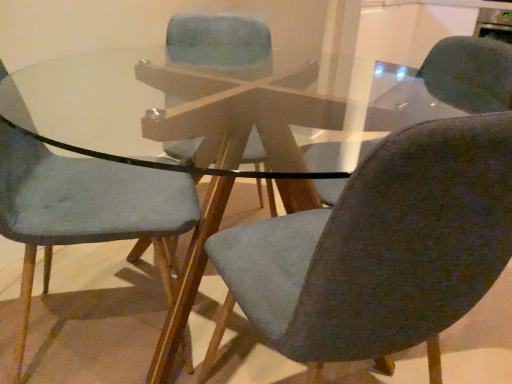
Describe the element at coordinates (220, 44) in the screenshot. The height and width of the screenshot is (384, 512). I see `textured fabric chair at center, marked as the 2th chair in a right-to-left arrangement` at that location.

At what (x,y) coordinates should I click in order to perform the action: click on textured gray chair at center, marked as the 1th chair in a right-to-left arrangement. Please return your answer as a coordinate pair (x, y). This screenshot has width=512, height=384. Looking at the image, I should click on (381, 247).

From a real-world perspective, is textured gray chair at center, marked as the 1th chair in a right-to-left arrangement, above or below textured fabric chair at center, placed as the second chair when sorted from left to right?

From a real-world perspective, textured gray chair at center, marked as the 1th chair in a right-to-left arrangement, is physically below textured fabric chair at center, placed as the second chair when sorted from left to right.

From the image's perspective, is textured gray chair at center, marked as the 1th chair in a right-to-left arrangement, positioned above or below textured fabric chair at center, marked as the 2th chair in a right-to-left arrangement?

From the image's perspective, textured gray chair at center, marked as the 1th chair in a right-to-left arrangement, appears below textured fabric chair at center, marked as the 2th chair in a right-to-left arrangement.

Is textured gray chair at center, the third chair in the left-to-right sequence, touching textured fabric chair at center, marked as the 2th chair in a right-to-left arrangement?

No, textured gray chair at center, the third chair in the left-to-right sequence, is not touching textured fabric chair at center, marked as the 2th chair in a right-to-left arrangement.

From the image's perspective, which object appears higher, matte gray chair at left, the 3th chair from the right, or textured fabric chair at center, placed as the second chair when sorted from left to right?

textured fabric chair at center, placed as the second chair when sorted from left to right, from the image's perspective.

Where is `chair that is behind the matte gray chair at left, the 3th chair from the right`? This screenshot has width=512, height=384. chair that is behind the matte gray chair at left, the 3th chair from the right is located at coordinates (220, 44).

Does matte gray chair at left, the 3th chair from the right, touch textured fabric chair at center, placed as the second chair when sorted from left to right?

There is a gap between matte gray chair at left, the 3th chair from the right, and textured fabric chair at center, placed as the second chair when sorted from left to right.

How different are the orientations of matte gray chair at left, the 1th chair positioned from the left, and textured fabric chair at center, marked as the 2th chair in a right-to-left arrangement, in degrees?

The angle between the facing direction of matte gray chair at left, the 1th chair positioned from the left, and the facing direction of textured fabric chair at center, marked as the 2th chair in a right-to-left arrangement, is 92.8 degrees.

Based on the photo, considering the sizes of objects textured gray chair at center, the third chair in the left-to-right sequence, and matte gray chair at left, the 3th chair from the right, in the image provided, who is bigger, textured gray chair at center, the third chair in the left-to-right sequence, or matte gray chair at left, the 3th chair from the right,?

Bigger between the two is textured gray chair at center, the third chair in the left-to-right sequence.

Is point (451, 246) closer to camera compared to point (168, 195)?

That is True.

In the image, is textured gray chair at center, marked as the 1th chair in a right-to-left arrangement, positioned in front of or behind matte gray chair at left, the 3th chair from the right?

textured gray chair at center, marked as the 1th chair in a right-to-left arrangement, is in front of matte gray chair at left, the 3th chair from the right.

What's the angular difference between matte gray chair at left, the 1th chair positioned from the left, and textured gray chair at center, marked as the 1th chair in a right-to-left arrangement,'s facing directions?

There is a 106-degree angle between the facing directions of matte gray chair at left, the 1th chair positioned from the left, and textured gray chair at center, marked as the 1th chair in a right-to-left arrangement.

Is matte gray chair at left, the 3th chair from the right, shorter than textured gray chair at center, marked as the 1th chair in a right-to-left arrangement?

No.

Which point is more forward, (189,204) or (426,298)?

The point (426,298) is in front.

From a real-world perspective, is matte gray chair at left, the 1th chair positioned from the left, on top of textured gray chair at center, marked as the 1th chair in a right-to-left arrangement?

Yes, from a real-world perspective, matte gray chair at left, the 1th chair positioned from the left, is over textured gray chair at center, marked as the 1th chair in a right-to-left arrangement

Can you confirm if textured fabric chair at center, placed as the second chair when sorted from left to right, is bigger than textured gray chair at center, the third chair in the left-to-right sequence?

No, textured fabric chair at center, placed as the second chair when sorted from left to right, is not bigger than textured gray chair at center, the third chair in the left-to-right sequence.

Is textured gray chair at center, the third chair in the left-to-right sequence, completely or partially inside textured fabric chair at center, placed as the second chair when sorted from left to right?

No, textured fabric chair at center, placed as the second chair when sorted from left to right, does not contain textured gray chair at center, the third chair in the left-to-right sequence.

Which is behind, point (238, 73) or point (411, 255)?

The point (238, 73) is behind.

How many degrees apart are the facing directions of textured fabric chair at center, marked as the 2th chair in a right-to-left arrangement, and textured gray chair at center, the third chair in the left-to-right sequence?

The angle between the facing direction of textured fabric chair at center, marked as the 2th chair in a right-to-left arrangement, and the facing direction of textured gray chair at center, the third chair in the left-to-right sequence, is 161 degrees.

Considering the relative positions of textured fabric chair at center, marked as the 2th chair in a right-to-left arrangement, and matte gray chair at left, the 3th chair from the right, in the image provided, is textured fabric chair at center, marked as the 2th chair in a right-to-left arrangement, to the left of matte gray chair at left, the 3th chair from the right, from the viewer's perspective?

No.

From a real-world perspective, is textured fabric chair at center, marked as the 2th chair in a right-to-left arrangement, beneath matte gray chair at left, the 1th chair positioned from the left?

Incorrect, from a real-world perspective, textured fabric chair at center, marked as the 2th chair in a right-to-left arrangement, is higher than matte gray chair at left, the 1th chair positioned from the left.

Can you tell me how much textured fabric chair at center, marked as the 2th chair in a right-to-left arrangement, and matte gray chair at left, the 3th chair from the right, differ in facing direction?

textured fabric chair at center, marked as the 2th chair in a right-to-left arrangement, and matte gray chair at left, the 3th chair from the right, are facing 92.8 degrees away from each other.

In terms of size, does textured fabric chair at center, placed as the second chair when sorted from left to right, appear bigger or smaller than matte gray chair at left, the 1th chair positioned from the left?

Considering their sizes, textured fabric chair at center, placed as the second chair when sorted from left to right, takes up less space than matte gray chair at left, the 1th chair positioned from the left.

At what (x,y) coordinates should I click in order to perform the action: click on the 1st chair to the left of the textured gray chair at center, the third chair in the left-to-right sequence, starting your count from the anchor. Please return your answer as a coordinate pair (x, y). This screenshot has width=512, height=384. Looking at the image, I should click on (220, 44).

The height and width of the screenshot is (384, 512). What are the coordinates of `the 1st chair counting from the right side of the matte gray chair at left, the 3th chair from the right` in the screenshot? It's located at point(220,44).

Looking at this image, based on their spatial positions, is matte gray chair at left, the 3th chair from the right, or textured fabric chair at center, marked as the 2th chair in a right-to-left arrangement, further from textured gray chair at center, marked as the 1th chair in a right-to-left arrangement?

textured fabric chair at center, marked as the 2th chair in a right-to-left arrangement, is positioned further to the anchor textured gray chair at center, marked as the 1th chair in a right-to-left arrangement.

From the image, which object appears to be farther from textured fabric chair at center, marked as the 2th chair in a right-to-left arrangement, matte gray chair at left, the 1th chair positioned from the left, or textured gray chair at center, the third chair in the left-to-right sequence?

The object further to textured fabric chair at center, marked as the 2th chair in a right-to-left arrangement, is textured gray chair at center, the third chair in the left-to-right sequence.

When comparing their distances from matte gray chair at left, the 3th chair from the right, does textured fabric chair at center, marked as the 2th chair in a right-to-left arrangement, or textured gray chair at center, the third chair in the left-to-right sequence, seem closer?

textured gray chair at center, the third chair in the left-to-right sequence.

Estimate the real-world distances between objects in this image. Which object is further from textured gray chair at center, the third chair in the left-to-right sequence, textured fabric chair at center, placed as the second chair when sorted from left to right, or matte gray chair at left, the 3th chair from the right?

Among the two, textured fabric chair at center, placed as the second chair when sorted from left to right, is located further to textured gray chair at center, the third chair in the left-to-right sequence.

Estimate the real-world distances between objects in this image. Which object is further from matte gray chair at left, the 1th chair positioned from the left, textured gray chair at center, marked as the 1th chair in a right-to-left arrangement, or textured fabric chair at center, placed as the second chair when sorted from left to right?

textured fabric chair at center, placed as the second chair when sorted from left to right.

Estimate the real-world distances between objects in this image. Which object is closer to textured fabric chair at center, marked as the 2th chair in a right-to-left arrangement, textured gray chair at center, the third chair in the left-to-right sequence, or matte gray chair at left, the 1th chair positioned from the left?

matte gray chair at left, the 1th chair positioned from the left.

Find the location of a particular element. The height and width of the screenshot is (384, 512). chair between textured gray chair at center, the third chair in the left-to-right sequence, and textured fabric chair at center, placed as the second chair when sorted from left to right, along the z-axis is located at coordinates (83, 208).